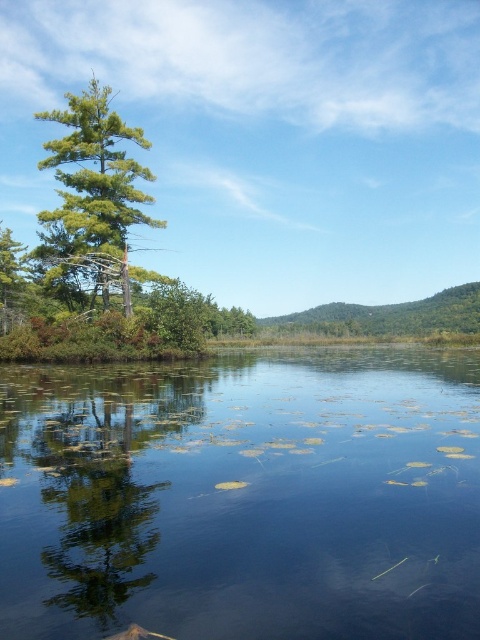
Question: Which point is farther to the camera?

Choices:
 (A) green leafy tree at center
 (B) green matte tree at left
 (C) green leafy water at center

Answer: (B)

Question: Where is green leafy water at center located in relation to green leafy tree at center in the image?

Choices:
 (A) below
 (B) above

Answer: (A)

Question: Among these points, which one is nearest to the camera?

Choices:
 (A) (24, 486)
 (B) (81, 176)
 (C) (166, 513)

Answer: (C)

Question: Estimate the real-world distances between objects in this image. Which object is farther from the green leafy water at center?

Choices:
 (A) green leafy tree at center
 (B) green matte tree at left

Answer: (B)

Question: Does green leafy tree at center have a smaller size compared to green matte tree at left?

Choices:
 (A) no
 (B) yes

Answer: (B)

Question: Can you confirm if green leafy water at center is positioned to the right of green matte tree at left?

Choices:
 (A) no
 (B) yes

Answer: (B)